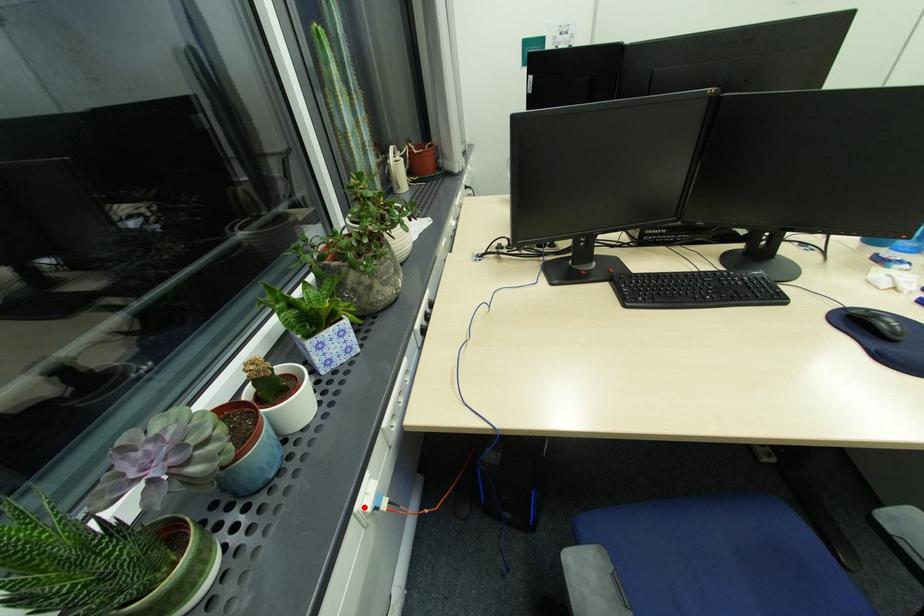
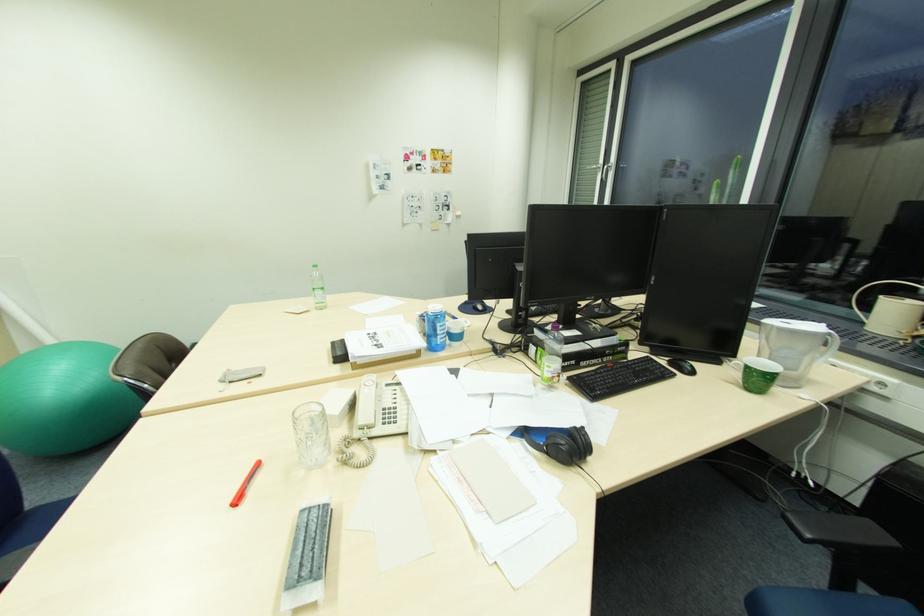
Question: I am providing you with two images of the same scene from different viewpoints. A red point is marked on the first image. Can you still see the location of the red point in image 2?

Choices:
 (A) Yes
 (B) No

Answer: (B)